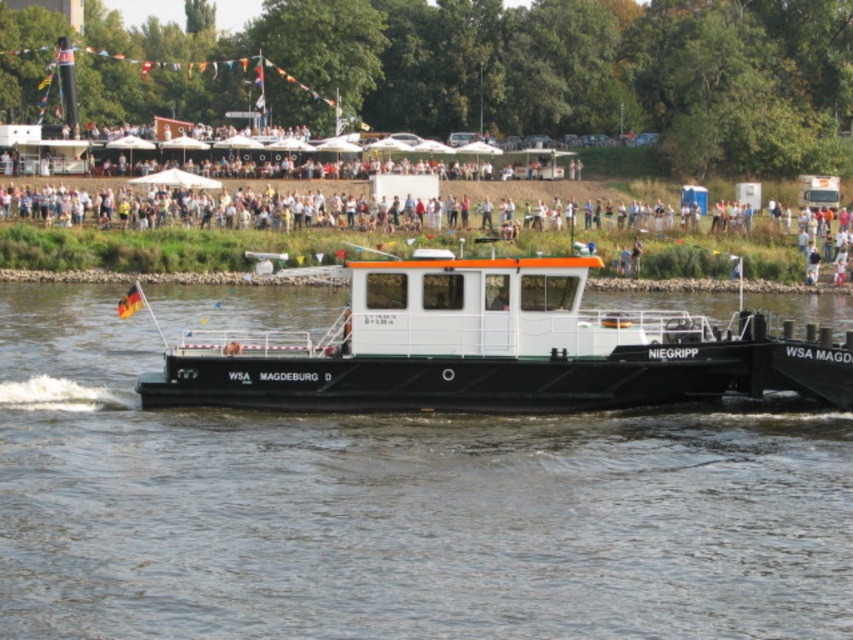
You are a photographer planning to capture both the black matte barge at center and the white matte barge at center in a single frame. Given their widths, which barge would require more space in your composition?

The black matte barge at center requires more space in the composition because its width surpasses that of the white matte barge at center.

You are a crane operator tasked with moving a container that is 6 meters long from the black matte barge at center to the white matte barge at center. Can you safely move the container between them without it hitting either barge?

The distance between the black matte barge at center and the white matte barge at center is 5.09 meters, which is shorter than the container length of 6 meters. The container cannot be moved safely between them without overlapping or hitting the barges.

You are a photographer standing on the riverside. You want to take a photo of the black matte barge at center and the white matte barge at center such that both are visible in the frame. Based on their positions, which barge should you focus on first to ensure both are in the shot?

The black matte barge at center is in front of the white matte barge at center, so you should focus on the white matte barge at center first to ensure both are visible in the frame.